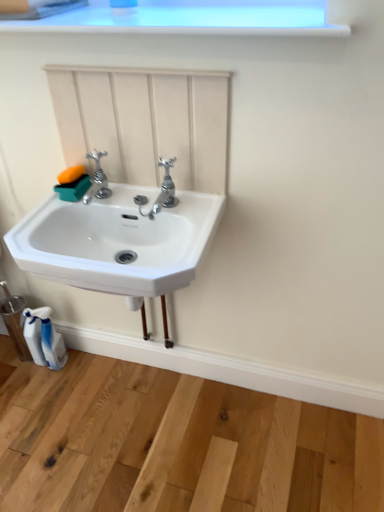
You are a GUI agent. You are given a task and a screenshot of the screen. Output one action in this format:
    pyautogui.click(x=<x>, y=<y>)
    Task: Click on the free space to the right of white plastic spray bottle at lower left
    This screenshot has width=384, height=512.
    Given the screenshot: What is the action you would take?
    pyautogui.click(x=92, y=373)